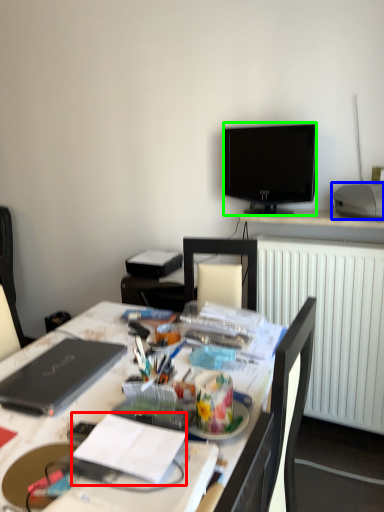
Question: Considering the real-world distances, which object is closest to notebook (highlighted by a red box)? printer (highlighted by a blue box) or television (highlighted by a green box).

Choices:
 (A) printer
 (B) television

Answer: (A)